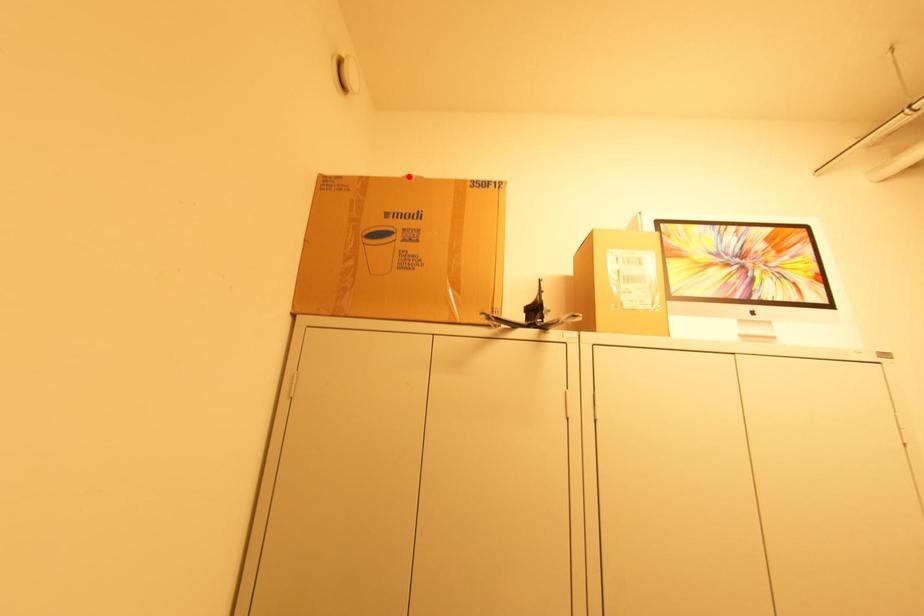
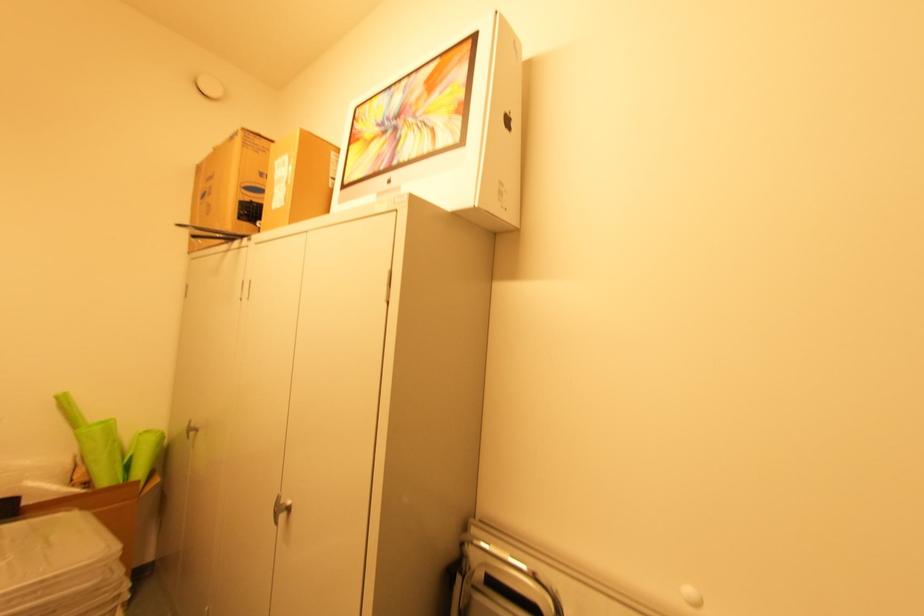
In the second image, find the point that corresponds to the highlighted location in the first image.

(216, 148)